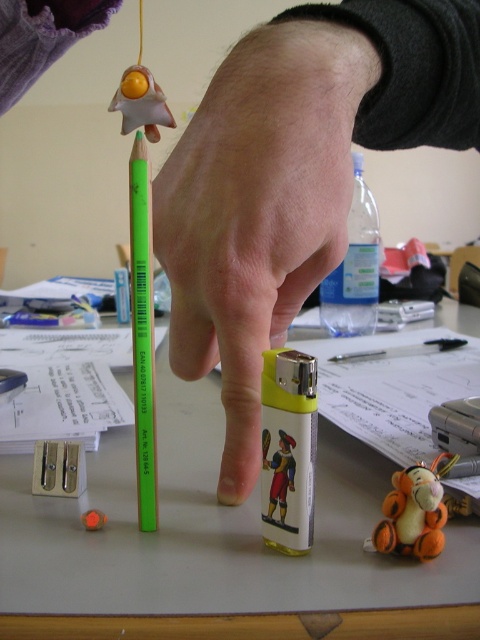
You are organizing items on the desk and need to place a new item between the white plastic table at center and the orange felt tigger at center. Based on their positions, where should you place the new item?

Since the white plastic table at center is to the left of the orange felt tigger at center, you should place the new item between them on the right side of the white plastic table at center and the left side of the orange felt tigger at center.